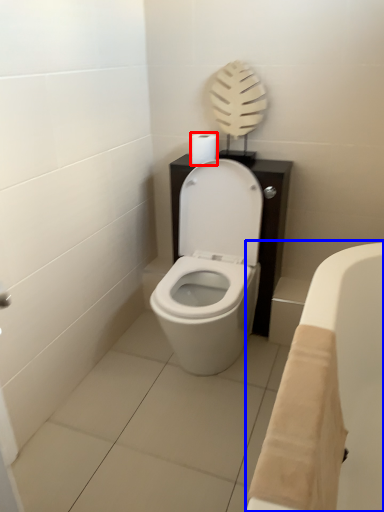
Question: Which of the following is the closest to the observer, toilet paper (highlighted by a red box) or bath (highlighted by a blue box)?

Choices:
 (A) toilet paper
 (B) bath

Answer: (B)